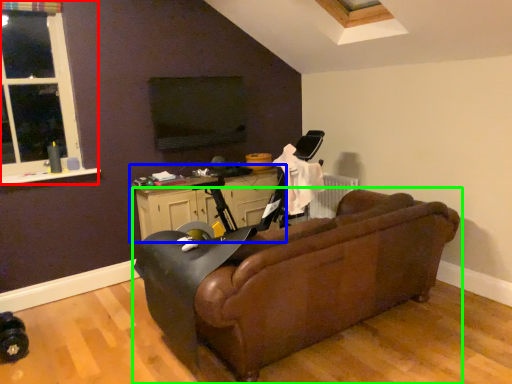
Question: Estimate the real-world distances between objects in this image. Which object is closer to window (highlighted by a red box), table (highlighted by a blue box) or studio couch (highlighted by a green box)?

Choices:
 (A) table
 (B) studio couch

Answer: (A)